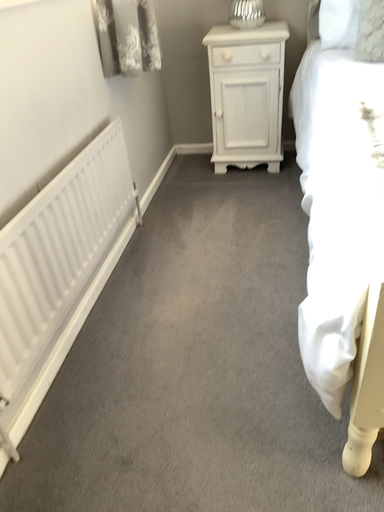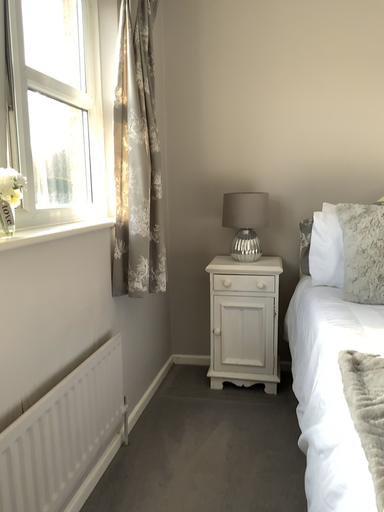
Question: Which way did the camera rotate in the video?

Choices:
 (A) rotated downward
 (B) rotated upward

Answer: (B)